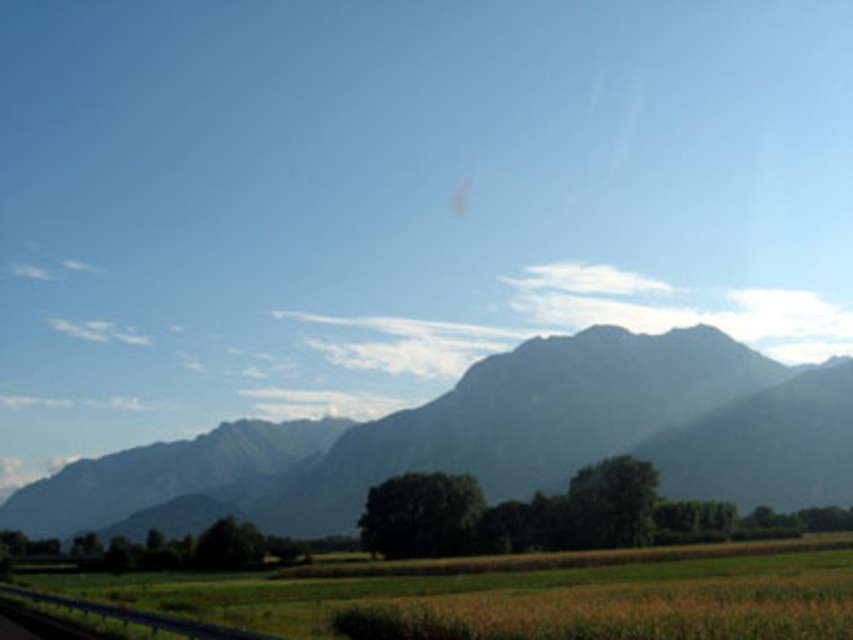
You are planning to hike across the brown grassy field at lower center and reach the gray rocky mountain at center. Considering their sizes, which one do you think covers more horizontal space in the image?

The gray rocky mountain at center covers more horizontal space than the brown grassy field at lower center because its width is larger.

You are a hiker planning to take a photo of the gray rocky mountain at center and the brown grassy field at lower center. Which object should you focus on first if you want to capture both in a single frame without moving your camera?

You should focus on the gray rocky mountain at center first because it is larger in size compared to the brown grassy field at lower center, allowing it to be the main subject while still including the smaller field in the frame.

You are a hiker planning to take a photo of the gray rocky mountain at center from the brown grassy field at lower center. Can you see the entire mountain from the field?

The brown grassy field at lower center is behind the gray rocky mountain at center, so you cannot see the entire mountain from the field because the mountain is in front of the field.